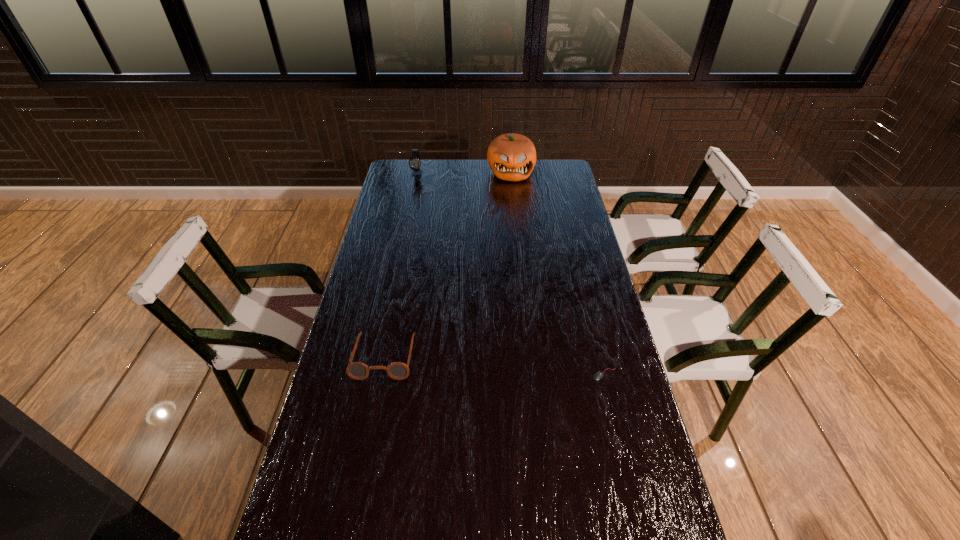
Locate an element on the screen. Image resolution: width=960 pixels, height=540 pixels. free area in between the second object from right to left and the rightmost object is located at coordinates (558, 273).

Where is `vacant point located between the tallest object and the third shortest object`? Image resolution: width=960 pixels, height=540 pixels. vacant point located between the tallest object and the third shortest object is located at coordinates (464, 173).

I want to click on unoccupied area between the mouse and the watch, so click(x=511, y=274).

Find the location of a particular element. vacant area that lies between the watch and the third tallest object is located at coordinates (401, 265).

At what (x,y) coordinates should I click in order to perform the action: click on free space between the pumpkin and the spectacles. Please return your answer as a coordinate pair (x, y). The height and width of the screenshot is (540, 960). Looking at the image, I should click on (447, 264).

Locate an element on the screen. free space between the spectacles and the pumpkin is located at coordinates (447, 264).

Find the location of `unoccupied area between the mouse and the second shortest object`. unoccupied area between the mouse and the second shortest object is located at coordinates (494, 365).

This screenshot has width=960, height=540. I want to click on free spot between the watch and the pumpkin, so click(x=464, y=173).

Where is `free space between the third tallest object and the second tallest object`? The width and height of the screenshot is (960, 540). free space between the third tallest object and the second tallest object is located at coordinates (401, 265).

Locate an element on the screen. The image size is (960, 540). vacant space that is in between the spectacles and the shortest object is located at coordinates (494, 365).